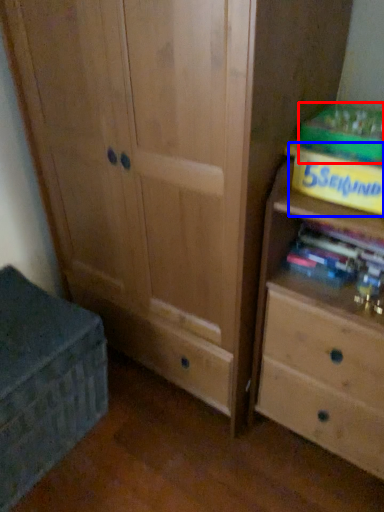
Question: Which object is further to the camera taking this photo, paperback book (highlighted by a red box) or paperback book (highlighted by a blue box)?

Choices:
 (A) paperback book
 (B) paperback book

Answer: (A)